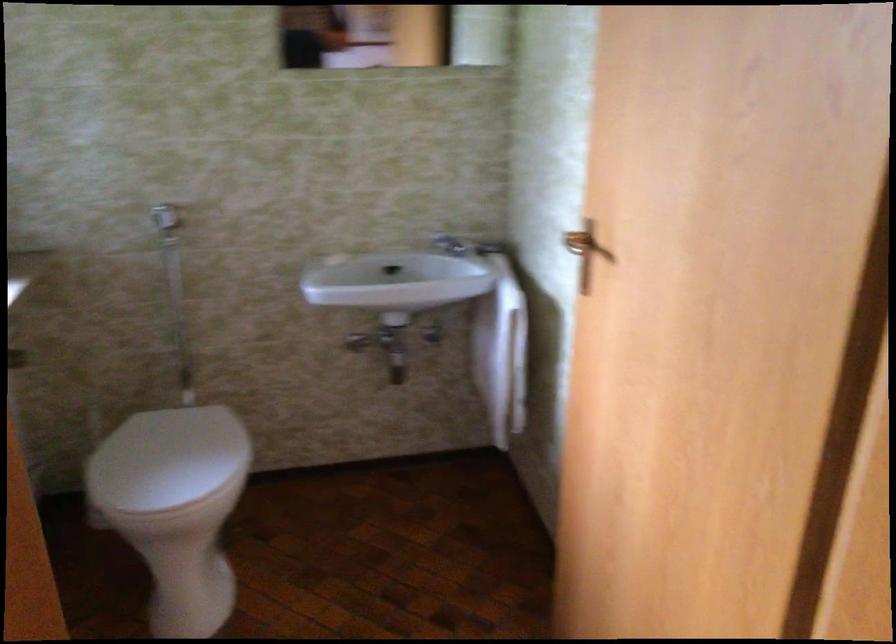
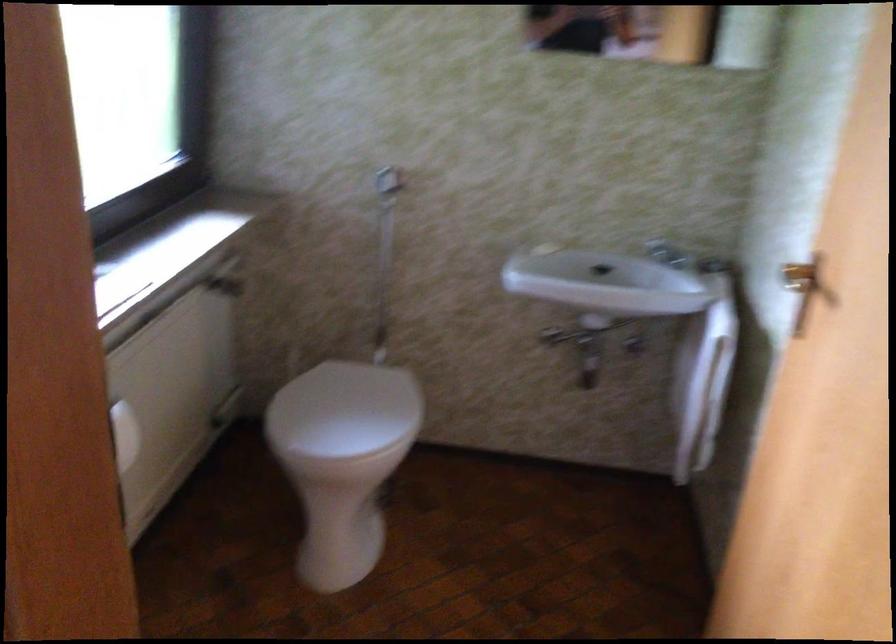
Which direction would the cameraman need to move to produce the second image?

The cameraman moved toward right, forward.